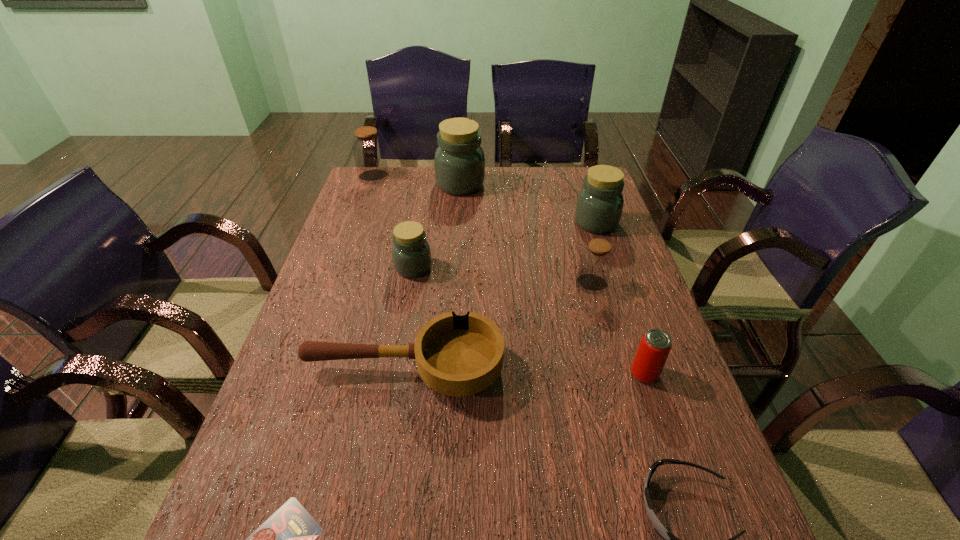
Locate an element on the screen. The image size is (960, 540). saucepan is located at coordinates (455, 355).

You are a GUI agent. You are given a task and a screenshot of the screen. Output one action in this format:
    pyautogui.click(x=<x>, y=<y>)
    Task: Click on the brown saucepan
    The height and width of the screenshot is (540, 960).
    Given the screenshot: What is the action you would take?
    click(455, 355)

Identify the location of free spot located 0.310m on the front of the tallest jar. Image resolution: width=960 pixels, height=540 pixels. [456, 253].

Identify the location of vacant space located on the front of the farther brown jar. The width and height of the screenshot is (960, 540). (369, 192).

This screenshot has width=960, height=540. Find the location of `vacant area located 0.320m on the left of the third farthest jar`. vacant area located 0.320m on the left of the third farthest jar is located at coordinates (475, 223).

Identify the location of vacant region located 0.170m on the front of the nearest green jar. The image size is (960, 540). (403, 326).

You are a GUI agent. You are given a task and a screenshot of the screen. Output one action in this format:
    pyautogui.click(x=<x>, y=<y>)
    Task: Click on the vacant space located on the front of the smaller brown jar
    
    Given the screenshot: What is the action you would take?
    628,415

Locate an element on the screen. This screenshot has height=540, width=960. vacant position located 0.320m on the back of the pink beer can is located at coordinates (611, 271).

Where is `jar at the left edge`? jar at the left edge is located at coordinates (368, 148).

You are a GUI agent. You are given a task and a screenshot of the screen. Output one action in this format:
    pyautogui.click(x=<x>, y=<y>)
    Task: Click on the saucepan located at the left edge
    
    Given the screenshot: What is the action you would take?
    pyautogui.click(x=455, y=355)